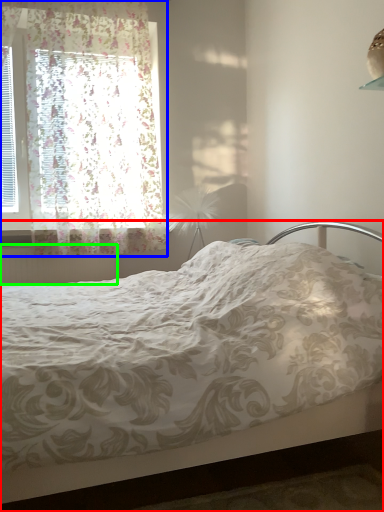
Question: Which is nearer to the bed (highlighted by a red box)? window (highlighted by a blue box) or radiator (highlighted by a green box).

Choices:
 (A) window
 (B) radiator

Answer: (B)